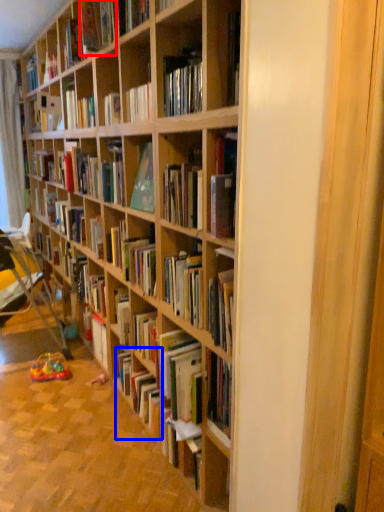
Question: Which point is closer to the camera, book (highlighted by a red box) or book (highlighted by a blue box)?

Choices:
 (A) book
 (B) book

Answer: (A)